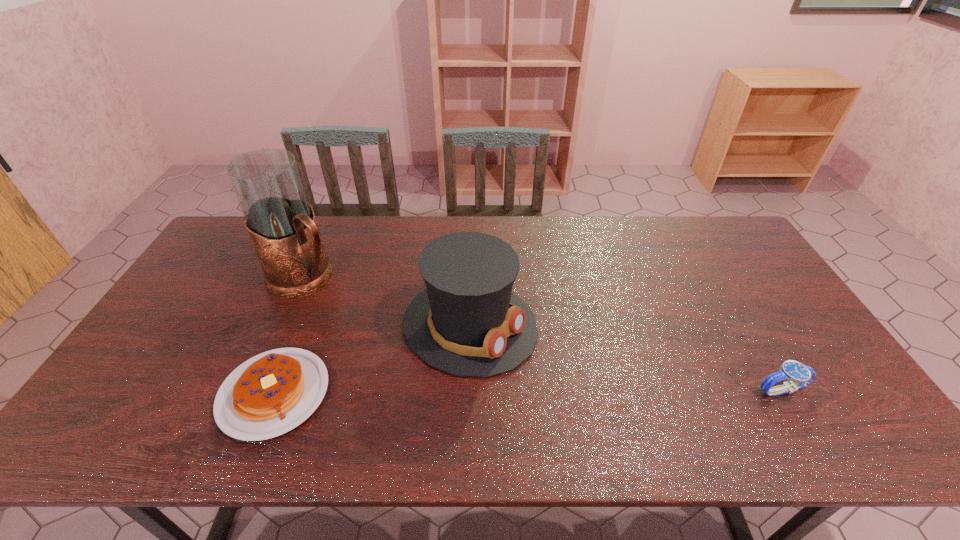
The image size is (960, 540). In the image, there is a desktop. In order to click on vacant space at the near edge in this screenshot , I will do `click(765, 400)`.

What are the coordinates of `vacant space at the left edge of the desktop` in the screenshot? It's located at (175, 377).

Find the location of a particular element. vacant region at the right edge of the desktop is located at coordinates (824, 367).

The image size is (960, 540). Identify the location of vacant space at the near left corner of the desktop. [x=158, y=385].

This screenshot has height=540, width=960. Identify the location of vacant space in between the third shortest object and the watch. (626, 358).

Find the location of a particular element. The height and width of the screenshot is (540, 960). free space between the pitcher and the second shortest object is located at coordinates (543, 334).

The height and width of the screenshot is (540, 960). I want to click on free point between the pitcher and the watch, so click(543, 334).

I want to click on vacant area that lies between the pitcher and the watch, so point(543,334).

Where is `free space between the pancake and the second shortest object`? The width and height of the screenshot is (960, 540). free space between the pancake and the second shortest object is located at coordinates (528, 392).

The height and width of the screenshot is (540, 960). What are the coordinates of `unoccupied area between the pitcher and the second object from right to left` in the screenshot? It's located at 388,301.